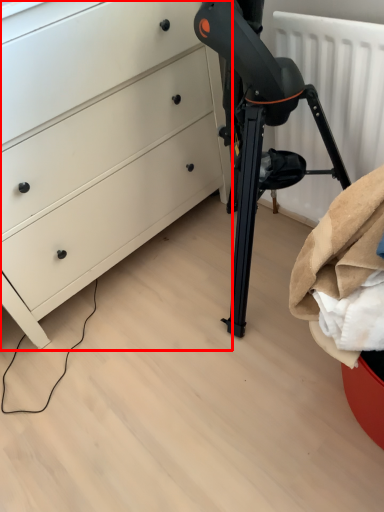
Question: From the image's perspective, what is the correct spatial positioning of chest of drawers (annotated by the red box) in reference to radiator?

Choices:
 (A) above
 (B) below

Answer: (A)